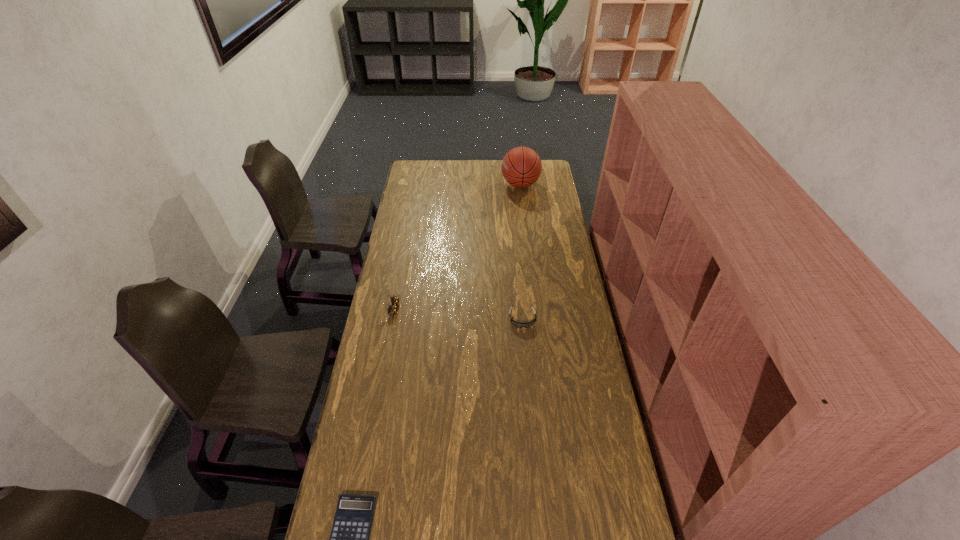
I want to click on object that is the closest to the tallest object, so click(517, 324).

You are a GUI agent. You are given a task and a screenshot of the screen. Output one action in this format:
    pyautogui.click(x=<x>, y=<y>)
    Task: Click on the third closest object relative to the left goggles
    The image size is (960, 540).
    Given the screenshot: What is the action you would take?
    pyautogui.click(x=521, y=167)

Where is `vacant space that satisfies the following two spatial constraints: 1. on the logo side of the farthest object; 2. on the front and sides of the right goggles`? This screenshot has height=540, width=960. vacant space that satisfies the following two spatial constraints: 1. on the logo side of the farthest object; 2. on the front and sides of the right goggles is located at coordinates (537, 319).

Locate an element on the screen. The height and width of the screenshot is (540, 960). free space in the image that satisfies the following two spatial constraints: 1. on the logo side of the basketball; 2. on the front and sides of the shorter goggles is located at coordinates (537, 319).

Locate an element on the screen. The width and height of the screenshot is (960, 540). blank area in the image that satisfies the following two spatial constraints: 1. on the logo side of the farthest object; 2. on the front and sides of the right goggles is located at coordinates (537, 319).